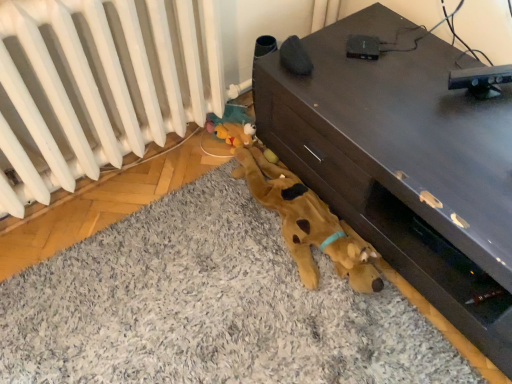
Question: Is brown matte tv stand at lower right wider than white matte radiator at lower left?

Choices:
 (A) no
 (B) yes

Answer: (B)

Question: Is brown matte tv stand at lower right at the right side of white matte radiator at lower left?

Choices:
 (A) yes
 (B) no

Answer: (A)

Question: Is the depth of brown matte tv stand at lower right less than that of white matte radiator at lower left?

Choices:
 (A) no
 (B) yes

Answer: (A)

Question: Is brown matte tv stand at lower right looking in the opposite direction of white matte radiator at lower left?

Choices:
 (A) yes
 (B) no

Answer: (B)

Question: Could you tell me if brown matte tv stand at lower right is turned towards white matte radiator at lower left?

Choices:
 (A) no
 (B) yes

Answer: (B)

Question: In terms of width, does soft gray carpet at lower center look wider or thinner when compared to white matte radiator at lower left?

Choices:
 (A) thin
 (B) wide

Answer: (B)

Question: Is soft gray carpet at lower center taller or shorter than white matte radiator at lower left?

Choices:
 (A) short
 (B) tall

Answer: (A)

Question: From the image's perspective, relative to white matte radiator at lower left, is soft gray carpet at lower center above or below?

Choices:
 (A) below
 (B) above

Answer: (A)

Question: Based on their positions, is soft gray carpet at lower center located to the left or right of white matte radiator at lower left?

Choices:
 (A) right
 (B) left

Answer: (A)

Question: Is point (369, 203) positioned closer to the camera than point (173, 13)?

Choices:
 (A) farther
 (B) closer

Answer: (A)

Question: Looking at their shapes, would you say brown matte tv stand at lower right is wider or thinner than white matte radiator at lower left?

Choices:
 (A) wide
 (B) thin

Answer: (A)

Question: From the image's perspective, is brown matte tv stand at lower right positioned above or below white matte radiator at lower left?

Choices:
 (A) below
 (B) above

Answer: (A)

Question: From a real-world perspective, is brown matte tv stand at lower right physically located above or below white matte radiator at lower left?

Choices:
 (A) below
 (B) above

Answer: (A)

Question: Is point (16, 24) closer or farther from the camera than point (500, 306)?

Choices:
 (A) closer
 (B) farther

Answer: (A)

Question: Is white matte radiator at lower left wider or thinner than brown matte tv stand at lower right?

Choices:
 (A) wide
 (B) thin

Answer: (B)